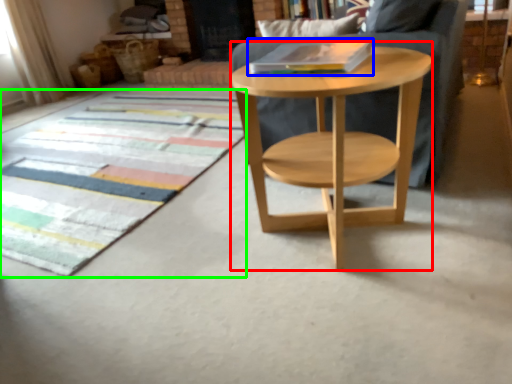
Question: Which is farther away from round table (highlighted by a red box)? book (highlighted by a blue box) or mat (highlighted by a green box)?

Choices:
 (A) book
 (B) mat

Answer: (B)